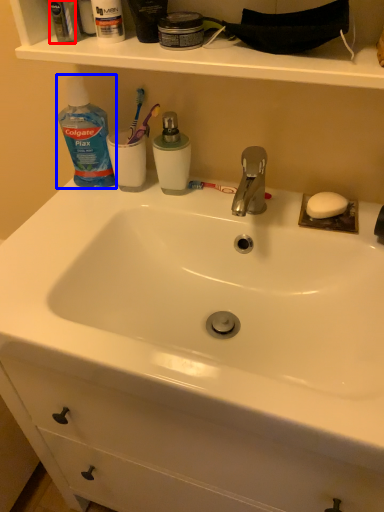
Question: Which object appears closest to the camera in this image, mouthwash (highlighted by a red box) or cleaning product (highlighted by a blue box)?

Choices:
 (A) mouthwash
 (B) cleaning product

Answer: (A)